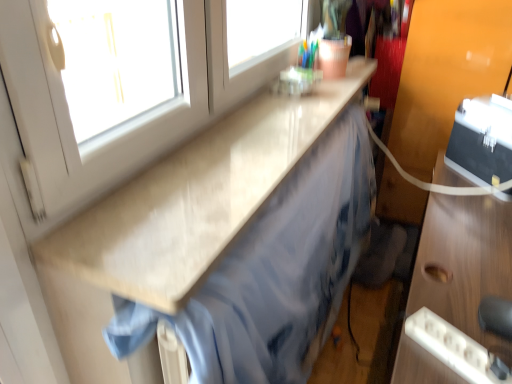
What do you see at coordinates (464, 261) in the screenshot? I see `wooden desk at right` at bounding box center [464, 261].

Where is `wooden desk at right`? wooden desk at right is located at coordinates (464, 261).

What is the approximate height of light beige laminate countertop at upper center?

light beige laminate countertop at upper center is 1.33 inches tall.

Image resolution: width=512 pixels, height=384 pixels. What do you see at coordinates (195, 198) in the screenshot?
I see `light beige laminate countertop at upper center` at bounding box center [195, 198].

Image resolution: width=512 pixels, height=384 pixels. Identify the location of light beige laminate countertop at upper center. (195, 198).

Locate an element on the screen. Image resolution: width=512 pixels, height=384 pixels. wooden desk at right is located at coordinates (464, 261).

Which object is positioned more to the right, wooden desk at right or light beige laminate countertop at upper center?

Positioned to the right is wooden desk at right.

Does wooden desk at right lie in front of light beige laminate countertop at upper center?

That is True.

Considering the positions of point (502, 255) and point (122, 289), is point (502, 255) closer or farther from the camera than point (122, 289)?

Point (502, 255) is farther from the camera than point (122, 289).

From the image's perspective, would you say wooden desk at right is positioned over light beige laminate countertop at upper center?

Incorrect, from the image's perspective, wooden desk at right is lower than light beige laminate countertop at upper center.

From a real-world perspective, who is located higher, wooden desk at right or light beige laminate countertop at upper center?

light beige laminate countertop at upper center, from a real-world perspective.

Considering the sizes of objects wooden desk at right and light beige laminate countertop at upper center in the image provided, who is thinner, wooden desk at right or light beige laminate countertop at upper center?

With smaller width is light beige laminate countertop at upper center.

Is wooden desk at right shorter than light beige laminate countertop at upper center?

No, wooden desk at right is not shorter than light beige laminate countertop at upper center.

Looking at the image, does wooden desk at right seem bigger or smaller compared to light beige laminate countertop at upper center?

Considering their sizes, wooden desk at right takes up more space than light beige laminate countertop at upper center.

Is light beige laminate countertop at upper center completely or partially inside wooden desk at right?

No.

Looking at this image, is there a large distance between wooden desk at right and light beige laminate countertop at upper center?

No, wooden desk at right is not far from light beige laminate countertop at upper center.

Is wooden desk at right positioned with its back to light beige laminate countertop at upper center?

That's not correct — wooden desk at right is not looking away from light beige laminate countertop at upper center.

Where is `countertop behind the wooden desk at right`? This screenshot has height=384, width=512. countertop behind the wooden desk at right is located at coordinates (195, 198).

Is light beige laminate countertop at upper center to the left or to the right of wooden desk at right in the image?

In the image, light beige laminate countertop at upper center appears on the left side of wooden desk at right.

Is light beige laminate countertop at upper center in front of or behind wooden desk at right in the image?

Clearly, light beige laminate countertop at upper center is behind wooden desk at right.

Between point (85, 217) and point (511, 267), which one is positioned behind?

The point (511, 267) is more distant.

From the image's perspective, is light beige laminate countertop at upper center above or below wooden desk at right?

light beige laminate countertop at upper center is above wooden desk at right.

From a real-world perspective, is light beige laminate countertop at upper center physically located above or below wooden desk at right?

light beige laminate countertop at upper center is situated higher than wooden desk at right in the real world.

Consider the image. Is light beige laminate countertop at upper center wider than wooden desk at right?

No, light beige laminate countertop at upper center is not wider than wooden desk at right.

Considering the sizes of light beige laminate countertop at upper center and wooden desk at right in the image, is light beige laminate countertop at upper center taller or shorter than wooden desk at right?

Considering their sizes, light beige laminate countertop at upper center has less height than wooden desk at right.

Between light beige laminate countertop at upper center and wooden desk at right, which one has smaller size?

light beige laminate countertop at upper center is smaller.

Do you think light beige laminate countertop at upper center is within wooden desk at right, or outside of it?

light beige laminate countertop at upper center is not enclosed by wooden desk at right.

Is light beige laminate countertop at upper center far from wooden desk at right?

light beige laminate countertop at upper center is near wooden desk at right, not far away.

Is light beige laminate countertop at upper center facing towards wooden desk at right?

No, light beige laminate countertop at upper center does not turn towards wooden desk at right.

Image resolution: width=512 pixels, height=384 pixels. What are the coordinates of `cabinetry in front of the light beige laminate countertop at upper center` in the screenshot? It's located at (464, 261).

I want to click on countertop behind the wooden desk at right, so click(x=195, y=198).

At what (x,y) coordinates should I click in order to perform the action: click on countertop on the left of the wooden desk at right. Please return your answer as a coordinate pair (x, y). Looking at the image, I should click on (195, 198).